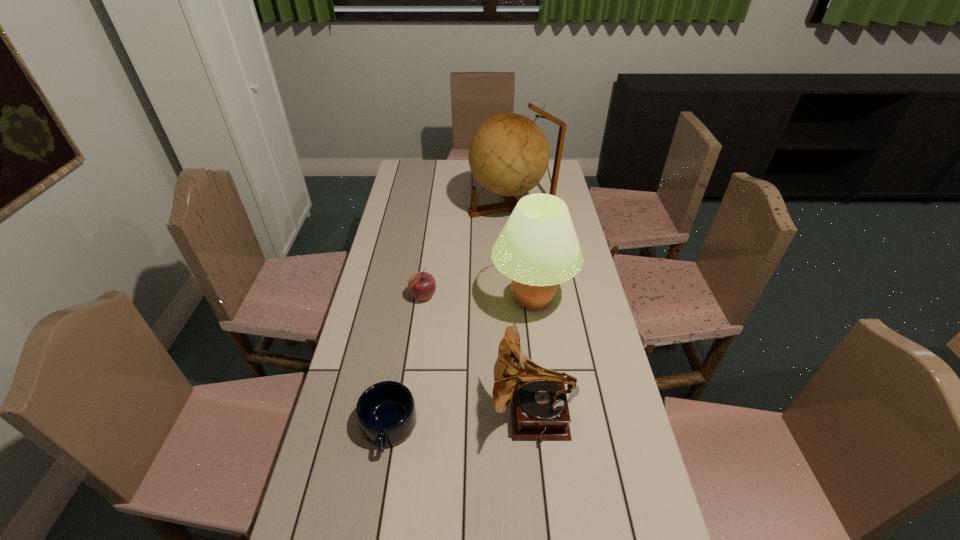
Where is `globe`? globe is located at coordinates pyautogui.click(x=508, y=154).

This screenshot has height=540, width=960. Find the location of `the farthest object`. the farthest object is located at coordinates (508, 154).

This screenshot has width=960, height=540. I want to click on lampshade, so click(538, 248).

At what (x,y) coordinates should I click in order to perform the action: click on the third shortest object. Please return your answer as a coordinate pair (x, y). Image resolution: width=960 pixels, height=540 pixels. Looking at the image, I should click on (539, 408).

Identify the location of the fourth tallest object. (422, 285).

Locate an element on the screen. The height and width of the screenshot is (540, 960). the shortest object is located at coordinates (386, 413).

Locate an element on the screen. This screenshot has height=540, width=960. free space located 0.070m on the surface of the farthest object is located at coordinates (452, 208).

I want to click on vacant space located 0.060m on the surface of the farthest object, so click(454, 208).

I want to click on vacant space located on the surface of the farthest object, so click(x=456, y=208).

Find the location of a particular element. free spot located on the shade of the second tallest object is located at coordinates (414, 300).